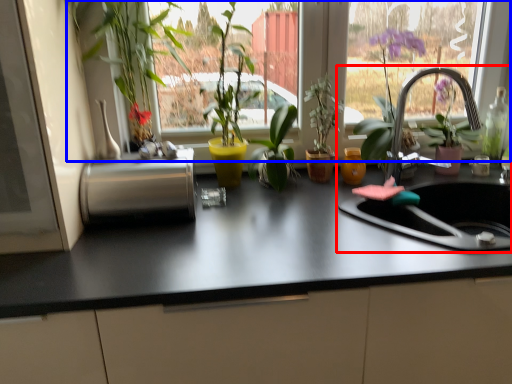
Question: Which point is further to the camera, sink (highlighted by a red box) or window (highlighted by a blue box)?

Choices:
 (A) sink
 (B) window

Answer: (B)